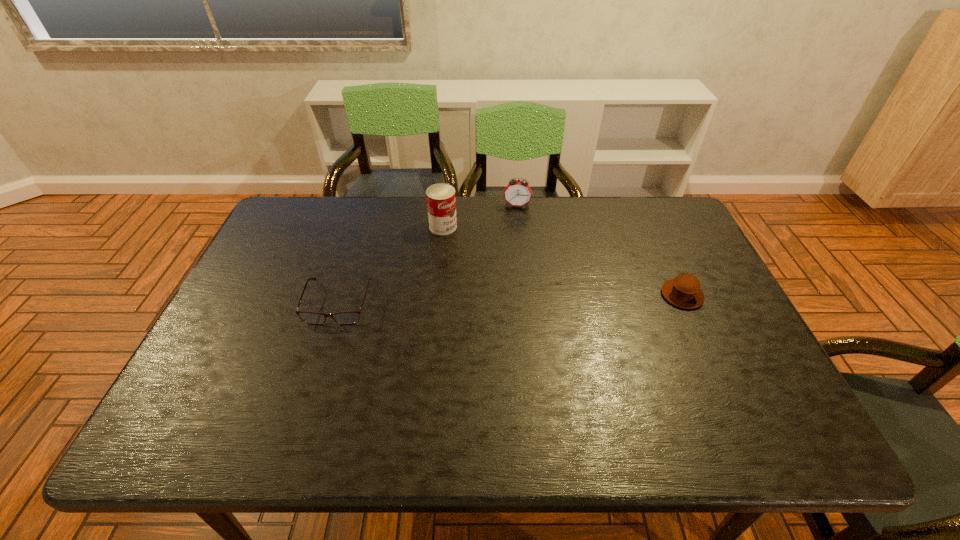
The height and width of the screenshot is (540, 960). Find the location of `free region at the near edge of the desktop`. free region at the near edge of the desktop is located at coordinates (491, 375).

This screenshot has height=540, width=960. Identify the location of free spot at the left edge of the desktop. (292, 283).

Identify the location of free space at the right edge of the desktop. The image size is (960, 540). (707, 348).

At what (x,y) coordinates should I click in order to perform the action: click on vacant region at the far left corner of the desktop. Please return your answer as a coordinate pair (x, y). Looking at the image, I should click on (301, 197).

I want to click on vacant space at the far right corner, so click(x=645, y=211).

The image size is (960, 540). In order to click on free space between the farthest object and the can in this screenshot , I will do `click(480, 216)`.

This screenshot has width=960, height=540. I want to click on empty space that is in between the second tallest object and the rightmost object, so click(x=599, y=251).

Where is `free space between the leftmost object and the second object from left to right`? This screenshot has width=960, height=540. free space between the leftmost object and the second object from left to right is located at coordinates (391, 265).

I want to click on vacant region between the spectacles and the third shortest object, so click(427, 254).

Find the location of a particular element. The image size is (960, 540). free space that is in between the third object from left to right and the spectacles is located at coordinates (427, 254).